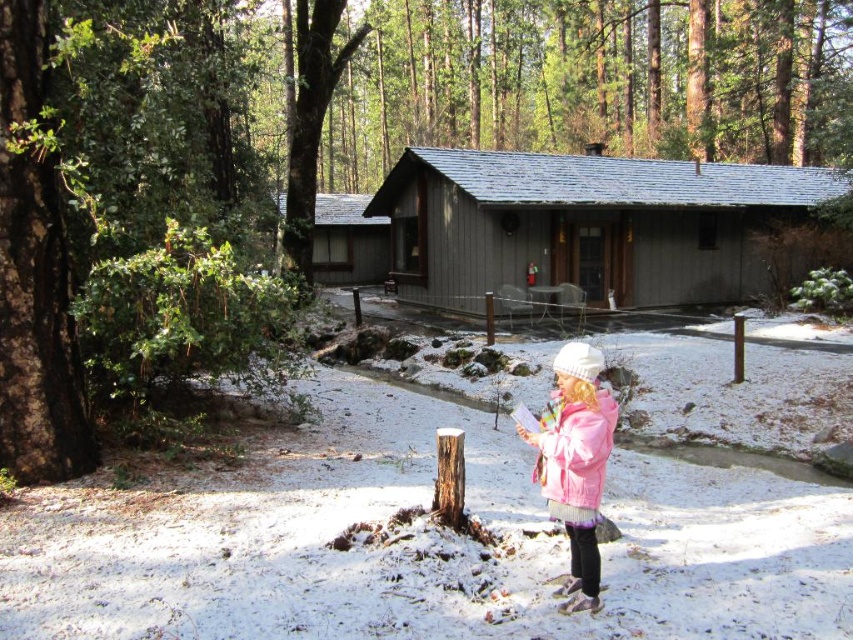
In order to click on pink fleece jacket at lower right in this screenshot , I will do `click(575, 461)`.

Which is above, pink fleece jacket at lower right or wooden cabin at center?

wooden cabin at center

Where is `pink fleece jacket at lower right`? pink fleece jacket at lower right is located at coordinates (575, 461).

Is wooden cabin at center behind pink fuzzy jacket at lower right?

Yes.

Does point (363, 205) come behind point (577, 420)?

Yes, it is.

I want to click on wooden cabin at center, so click(347, 241).

Image resolution: width=853 pixels, height=640 pixels. Describe the element at coordinates (575, 461) in the screenshot. I see `pink fleece jacket at lower right` at that location.

Consider the image. Is the position of pink fleece jacket at lower right less distant than that of pink fuzzy jacket at lower right?

No.

Between point (593, 541) and point (596, 428), which one is positioned in front?

Point (596, 428) is in front.

I want to click on pink fleece jacket at lower right, so click(575, 461).